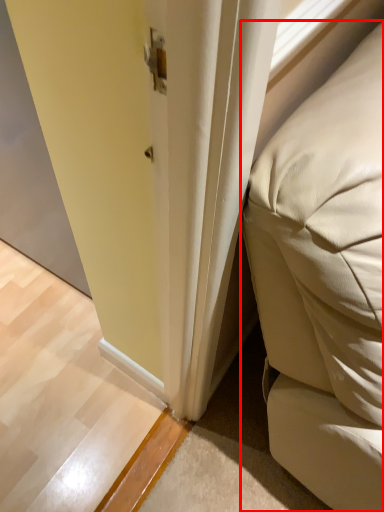
Question: Where is furniture (annotated by the red box) located in relation to screen door in the image?

Choices:
 (A) left
 (B) right

Answer: (B)